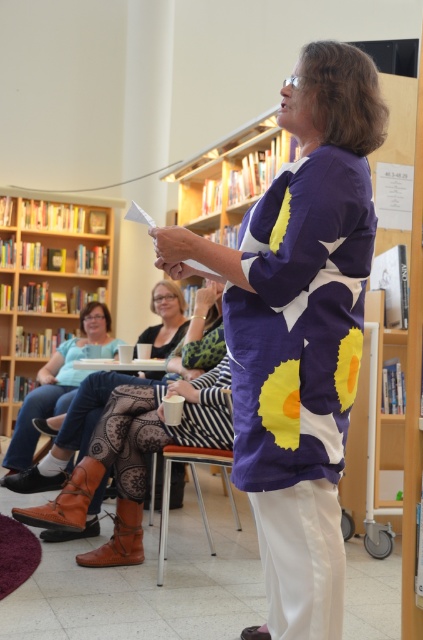
Is point (32, 401) farther from viewer compared to point (214, 465)?

Yes, point (32, 401) is behind point (214, 465).

This screenshot has height=640, width=423. In order to click on jeans at lower left in this screenshot , I will do `click(57, 384)`.

Is wooden bookcase at upper left in front of jeans at lower left?

No.

Can you confirm if wooden bookcase at upper left is taller than jeans at lower left?

Yes.

Between point (47, 205) and point (43, 372), which one is positioned behind?

Point (47, 205)

At what (x,y) coordinates should I click in order to perform the action: click on wooden bookcase at upper left. Please return your answer as a coordinate pair (x, y). Looking at the image, I should click on (46, 282).

Does wooden bookcase at upper left have a greater width compared to metallic silver chair at center?

Yes, wooden bookcase at upper left is wider than metallic silver chair at center.

Which is more to the left, wooden bookcase at upper left or metallic silver chair at center?

Positioned to the left is wooden bookcase at upper left.

Does point (18, 253) come in front of point (216, 456)?

No.

The image size is (423, 640). Find the location of `wooden bookcase at upper left`. wooden bookcase at upper left is located at coordinates (46, 282).